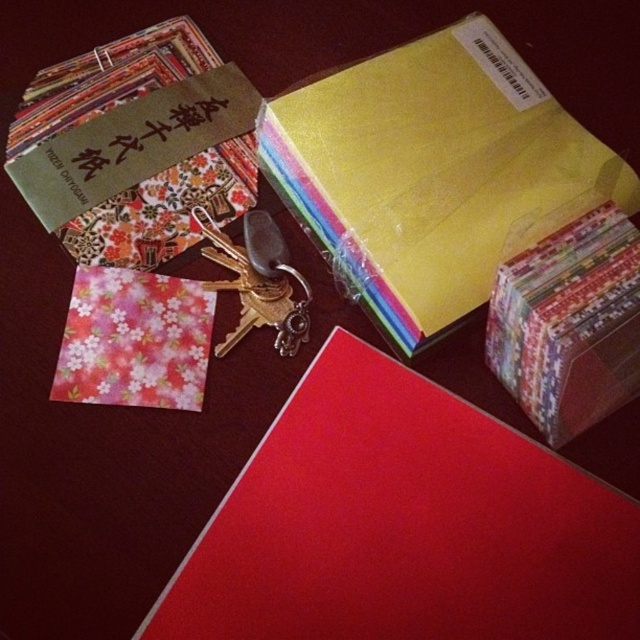
Which is more to the left, yellow matte/envelope at upper center or floral paper at lower left?

From the viewer's perspective, floral paper at lower left appears more on the left side.

Can you confirm if yellow matte/envelope at upper center is positioned to the left of floral paper at lower left?

No, yellow matte/envelope at upper center is not to the left of floral paper at lower left.

Identify the location of yellow matte/envelope at upper center. The height and width of the screenshot is (640, 640). (433, 172).

Who is positioned more to the left, yellow matte/envelope at upper center or floral paper gift box at upper right?

Positioned to the left is yellow matte/envelope at upper center.

Does yellow matte/envelope at upper center appear on the left side of floral paper gift box at upper right?

Indeed, yellow matte/envelope at upper center is positioned on the left side of floral paper gift box at upper right.

What are the coordinates of `yellow matte/envelope at upper center` in the screenshot? It's located at (433, 172).

Is point (184, 324) more distant than point (253, 285)?

No.

Does floral paper at lower left have a greater height compared to metallic gold key at center?

Incorrect, floral paper at lower left's height is not larger of metallic gold key at center's.

Describe the element at coordinates (134, 340) in the screenshot. I see `floral paper at lower left` at that location.

At what (x,y) coordinates should I click in order to perform the action: click on floral paper at lower left. Please return your answer as a coordinate pair (x, y). Looking at the image, I should click on (134, 340).